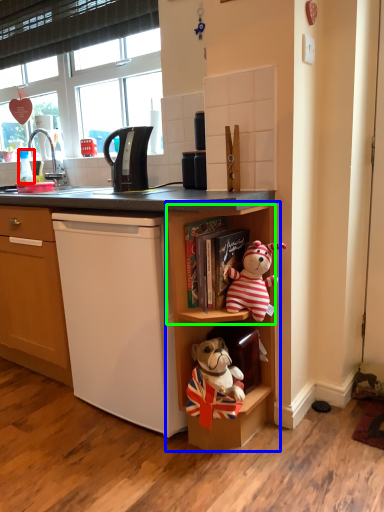
Question: Which object is positioned closest to coffee cup (highlighted by a red box)? Select from shelf (highlighted by a blue box) and shelf (highlighted by a green box).

Choices:
 (A) shelf
 (B) shelf

Answer: (B)